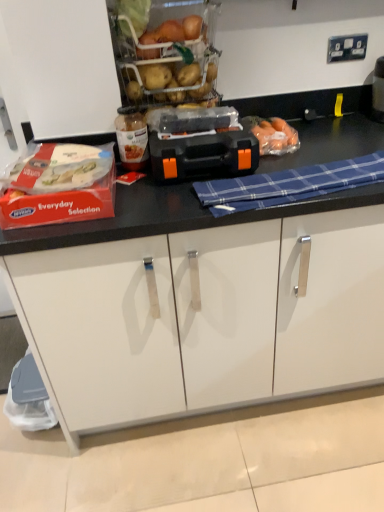
Locate an element on the screen. empty space that is ontop of black plastic toolbox at center (from a real-world perspective) is located at coordinates (205, 131).